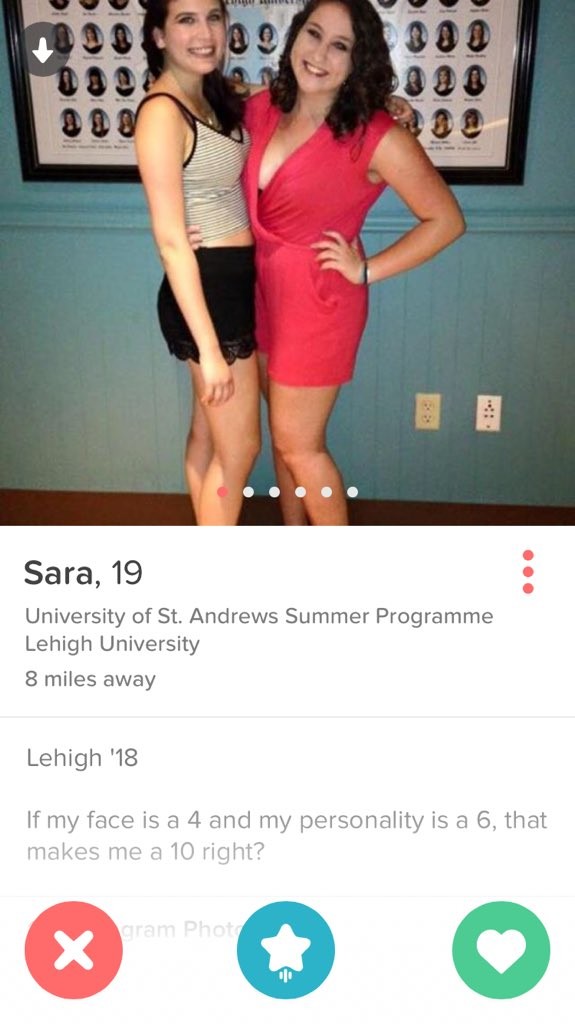
Identify the location of green wall in background. This screenshot has width=575, height=1024. (540, 162).